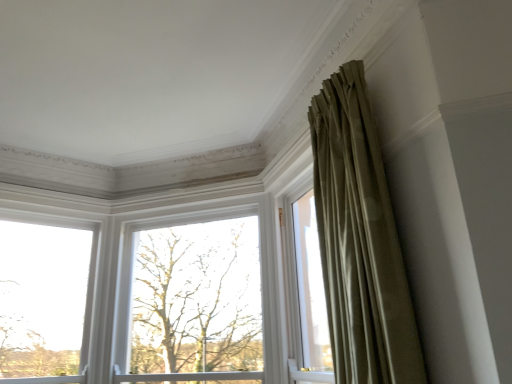
Question: Is clear glass window at left, the 2th window when ordered from right to left, taller or shorter than bare branches at center?

Choices:
 (A) tall
 (B) short

Answer: (B)

Question: From a real-world perspective, relative to bare branches at center, is clear glass window at left, the 2th window when ordered from right to left, vertically above or below?

Choices:
 (A) above
 (B) below

Answer: (A)

Question: Estimate the real-world distances between objects in this image. Which object is closer to the clear glass window at left, the 2th window when ordered from right to left?

Choices:
 (A) bare branches at center
 (B) silky olive drab curtain at upper right
 (C) white matte window at center, which is the second window in left-to-right order

Answer: (C)

Question: Which object is positioned farthest from the clear glass window at left, which is the 1th window from left to right?

Choices:
 (A) white matte window at center, which is the second window in left-to-right order
 (B) bare branches at center
 (C) silky olive drab curtain at upper right

Answer: (C)